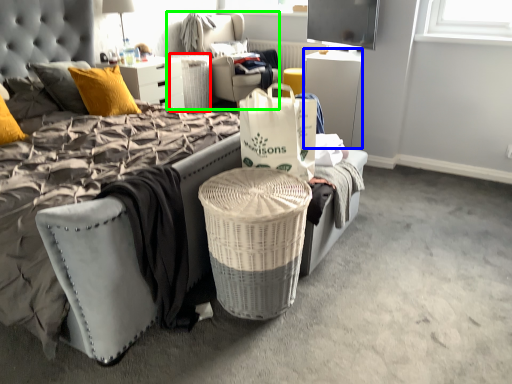
Question: Which object is the farthest from trash bin/can (highlighted by a red box)? Choose among these: desk (highlighted by a blue box) or bean bag chair (highlighted by a green box).

Choices:
 (A) desk
 (B) bean bag chair

Answer: (A)